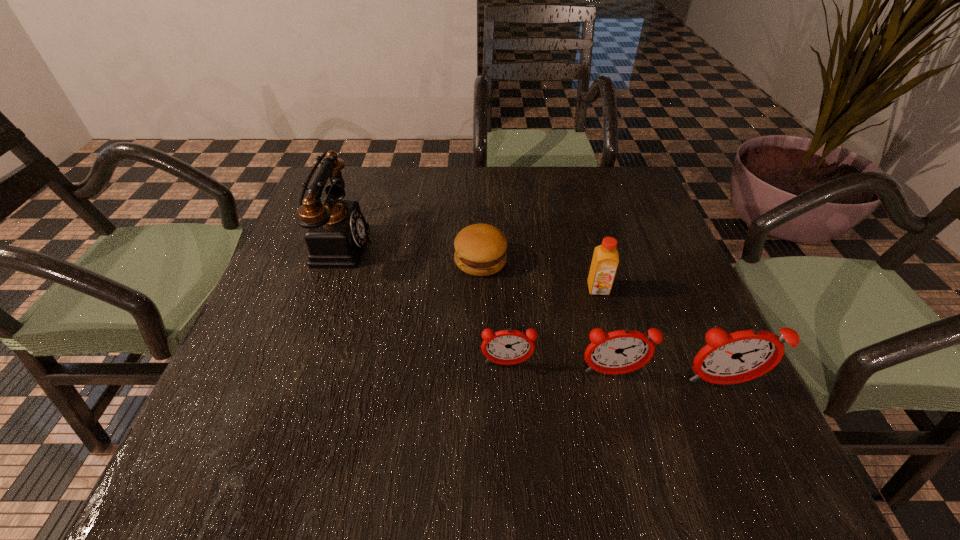
I want to click on the shortest alarm clock, so [506, 347].

At what (x,y) coordinates should I click in order to perform the action: click on the second shortest object. Please return your answer as a coordinate pair (x, y). This screenshot has width=960, height=540. Looking at the image, I should click on (506, 347).

Where is `the second tallest alarm clock`? Image resolution: width=960 pixels, height=540 pixels. the second tallest alarm clock is located at coordinates (x=622, y=351).

The image size is (960, 540). Identify the location of the rightmost object. (732, 358).

Where is `the tallest alarm clock`? the tallest alarm clock is located at coordinates (732, 358).

The height and width of the screenshot is (540, 960). What are the coordinates of `the shortest object` in the screenshot? It's located at (480, 249).

Find the location of `telephone`. telephone is located at coordinates (336, 232).

Identify the location of the leftmost object. (336, 232).

This screenshot has height=540, width=960. I want to click on orange juice, so click(605, 260).

This screenshot has height=540, width=960. Find the location of `vacant space located on the front-facing side of the second shortest object`. vacant space located on the front-facing side of the second shortest object is located at coordinates (510, 403).